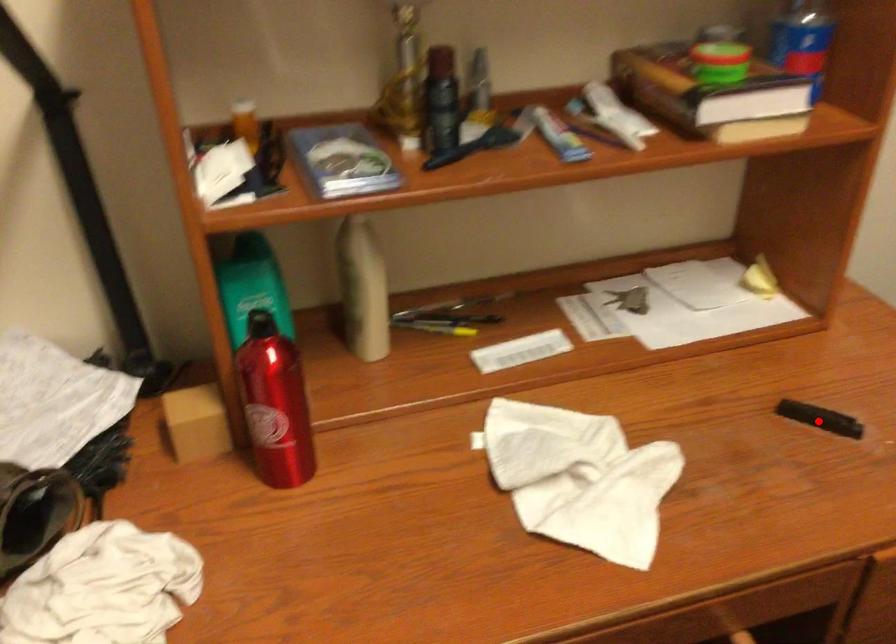
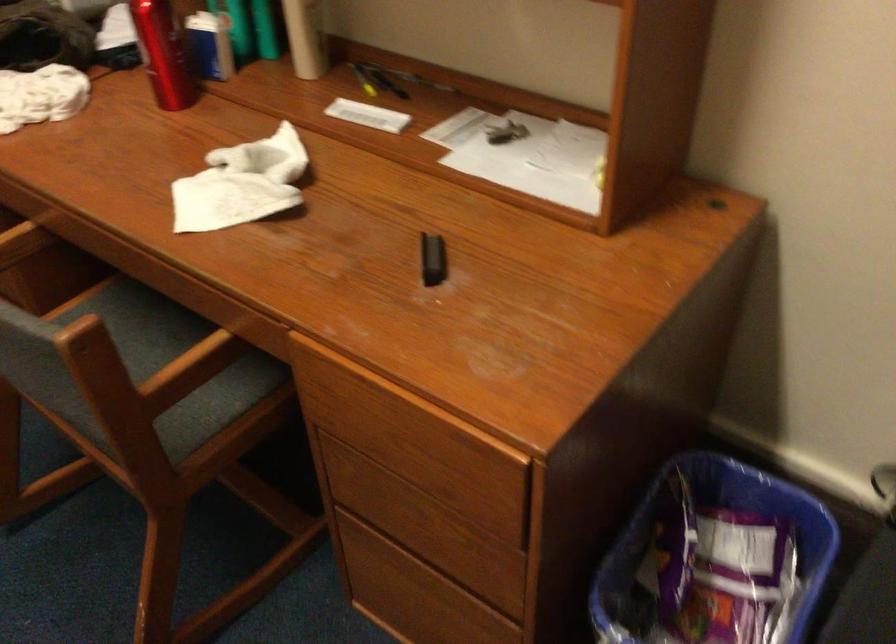
The point at the highlighted location is marked in the first image. Where is the corresponding point in the second image?

(433, 259)